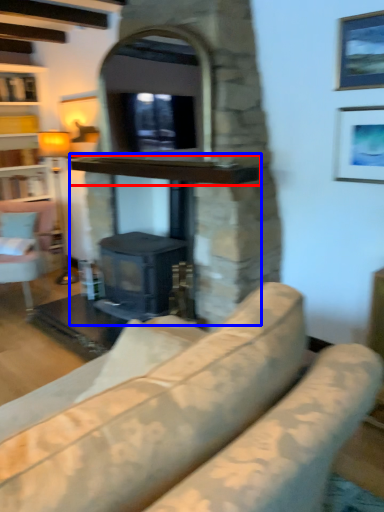
Question: Which point is closer to the camera, mantle (highlighted by a red box) or fireplace (highlighted by a blue box)?

Choices:
 (A) mantle
 (B) fireplace

Answer: (A)